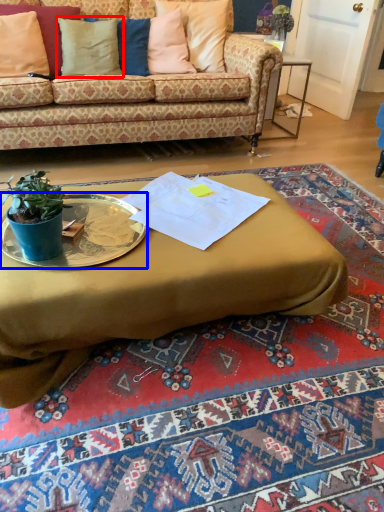
Question: Which object appears farthest to the camera in this image, pillow (highlighted by a red box) or platter (highlighted by a blue box)?

Choices:
 (A) pillow
 (B) platter

Answer: (A)